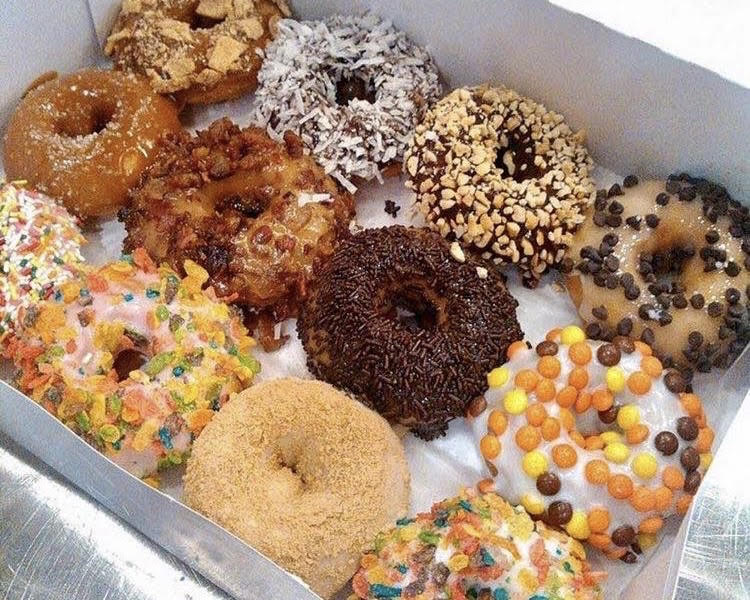
The width and height of the screenshot is (750, 600). Find the location of `inside sides of donut box`. inside sides of donut box is located at coordinates (464, 40), (694, 117), (24, 23).